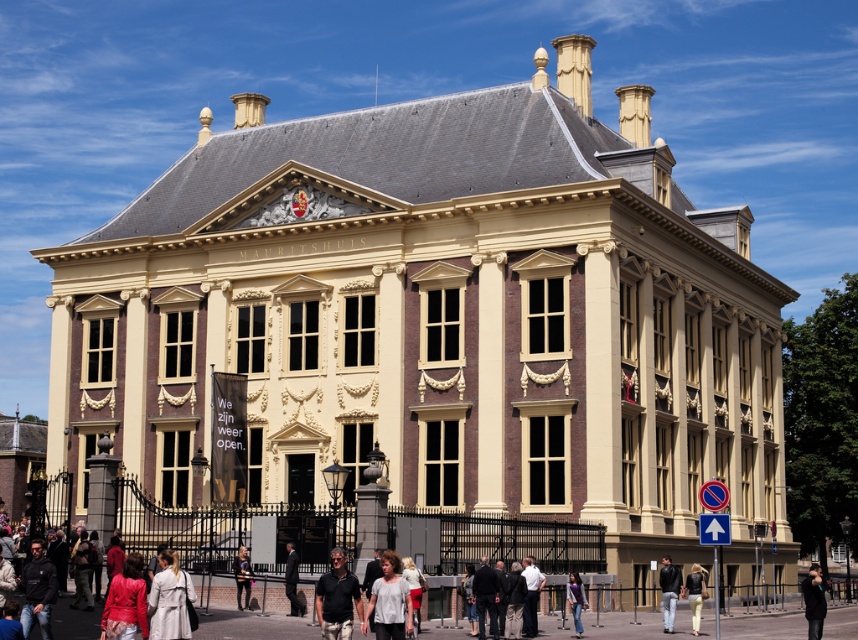
Looking at this image, you are a security guard at the Mauritshuis museum and notice two items left unattended near the entrance. The items are the leather jacket at lower right and the denim pants at lower right. Which item takes up more horizontal space?

The denim pants at lower right takes up more horizontal space since the leather jacket at lower right has a lesser width compared to denim pants at lower right.

You are standing in front of the Mauritshuis museum and notice two items near the entrance. You see a light beige trench coat at lower left and a leather jacket at lower right. Which item is positioned higher relative to the other?

The light beige trench coat at lower left is located above the leather jacket at lower right.